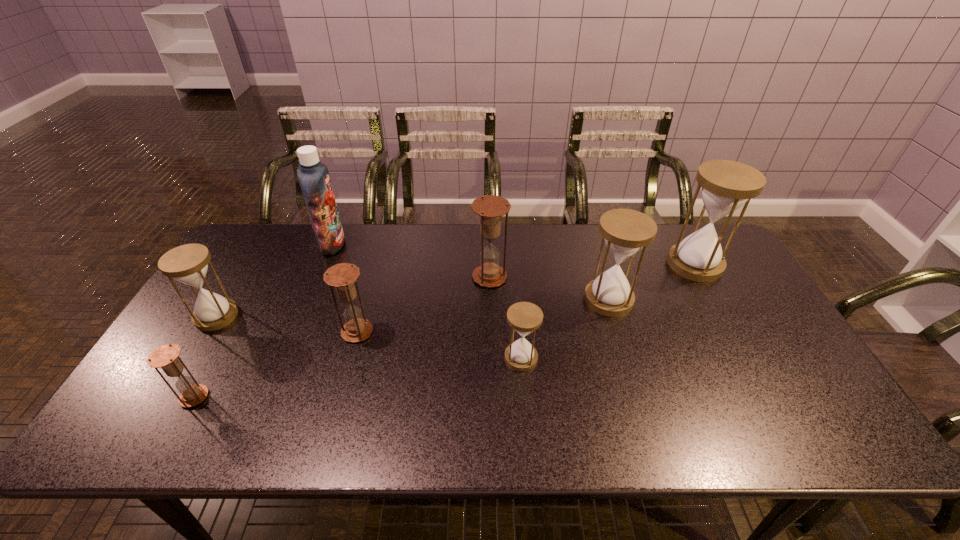
I want to click on vacant space positioned 0.290m on the back of the third biggest white hourglass, so click(261, 242).

I want to click on free spot located on the right of the nearest white hourglass, so click(584, 357).

Locate an element on the screen. The width and height of the screenshot is (960, 540). free space located 0.130m on the back of the leftmost brown hourglass is located at coordinates (224, 344).

Identify the location of shampoo that is positioned at the far edge. (313, 176).

Where is `object positioned at the right edge`? object positioned at the right edge is located at coordinates (726, 185).

At what (x,y) coordinates should I click in order to perform the action: click on object that is at the far right corner. Please return your answer as a coordinate pair (x, y). This screenshot has height=540, width=960. Looking at the image, I should click on (726, 185).

Locate an element on the screen. The image size is (960, 540). free location at the far edge is located at coordinates (600, 250).

You are a GUI agent. You are given a task and a screenshot of the screen. Output one action in this format:
    pyautogui.click(x=<x>, y=<y>)
    Task: Click on the vacant area at the near edge of the desktop
    
    Given the screenshot: What is the action you would take?
    pyautogui.click(x=262, y=421)

Image resolution: width=960 pixels, height=540 pixels. Find the location of `vacant space at the left edge of the desktop`. vacant space at the left edge of the desktop is located at coordinates (228, 347).

In the image, there is a desktop. Where is `vacant area at the right edge`? The image size is (960, 540). vacant area at the right edge is located at coordinates (767, 361).